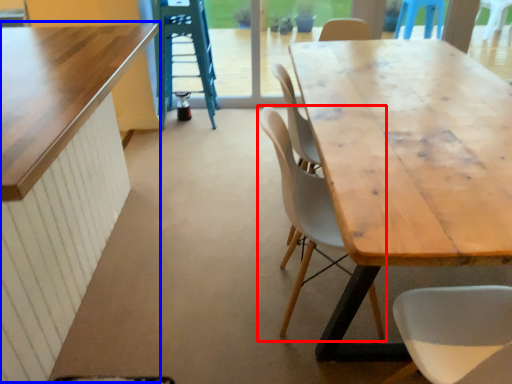
Question: Which object is further to the camera taking this photo, chair (highlighted by a red box) or table (highlighted by a blue box)?

Choices:
 (A) chair
 (B) table

Answer: (A)